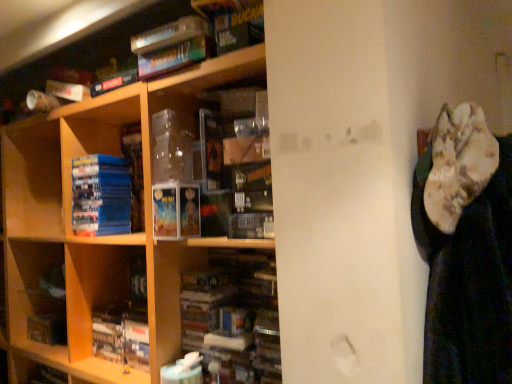
Question: In which direction should I rotate to look at hardcover book at center, placed as the 2th book when sorted from top to bottom?

Choices:
 (A) right
 (B) left

Answer: (B)

Question: From a real-world perspective, is matte paperbacks at center beneath hardcover book at center, placed as the 2th book when sorted from top to bottom?

Choices:
 (A) yes
 (B) no

Answer: (B)

Question: Does matte paperbacks at center have a larger size compared to hardcover book at center, placed as the 2th book when sorted from top to bottom?

Choices:
 (A) yes
 (B) no

Answer: (B)

Question: From a real-world perspective, is matte paperbacks at center over hardcover book at center, acting as the 1th book starting from the bottom?

Choices:
 (A) no
 (B) yes

Answer: (B)

Question: Is there a large distance between matte paperbacks at center and hardcover book at center, placed as the 2th book when sorted from top to bottom?

Choices:
 (A) yes
 (B) no

Answer: (B)

Question: Considering the relative positions of matte paperbacks at center and hardcover book at center, placed as the 2th book when sorted from top to bottom, in the image provided, is matte paperbacks at center to the right of hardcover book at center, placed as the 2th book when sorted from top to bottom, from the viewer's perspective?

Choices:
 (A) yes
 (B) no

Answer: (A)

Question: Is matte paperbacks at center shorter than hardcover book at center, placed as the 2th book when sorted from top to bottom?

Choices:
 (A) yes
 (B) no

Answer: (A)

Question: Does hardcover book at center, acting as the 1th book starting from the bottom, appear on the right side of blue matte book at left, marked as the 2th book in a bottom-to-top arrangement?

Choices:
 (A) no
 (B) yes

Answer: (B)

Question: Can you confirm if hardcover book at center, placed as the 2th book when sorted from top to bottom, is thinner than blue matte book at left, which is counted as the first book, starting from the top?

Choices:
 (A) no
 (B) yes

Answer: (B)

Question: Is hardcover book at center, acting as the 1th book starting from the bottom, facing away from blue matte book at left, marked as the 2th book in a bottom-to-top arrangement?

Choices:
 (A) yes
 (B) no

Answer: (B)

Question: From a real-world perspective, is hardcover book at center, acting as the 1th book starting from the bottom, physically below blue matte book at left, marked as the 2th book in a bottom-to-top arrangement?

Choices:
 (A) no
 (B) yes

Answer: (B)

Question: Considering the relative sizes of hardcover book at center, placed as the 2th book when sorted from top to bottom, and blue matte book at left, which is counted as the first book, starting from the top, in the image provided, is hardcover book at center, placed as the 2th book when sorted from top to bottom, bigger than blue matte book at left, which is counted as the first book, starting from the top,?

Choices:
 (A) no
 (B) yes

Answer: (A)

Question: Is hardcover book at center, acting as the 1th book starting from the bottom, surrounding blue matte book at left, marked as the 2th book in a bottom-to-top arrangement?

Choices:
 (A) no
 (B) yes

Answer: (A)

Question: Is the surface of wooden shelf at center in direct contact with hardcover book at center, acting as the 1th book starting from the bottom?

Choices:
 (A) no
 (B) yes

Answer: (A)